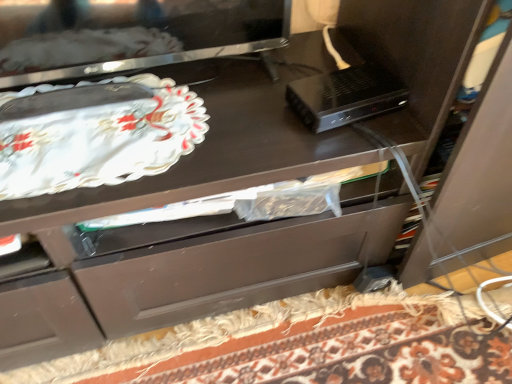
Identify the location of black plastic device at upper right. (345, 96).

What do you see at coordinates (345, 96) in the screenshot? I see `black plastic device at upper right` at bounding box center [345, 96].

You are a GUI agent. You are given a task and a screenshot of the screen. Output one action in this format:
    pyautogui.click(x=<x>, y=<y>)
    Task: Click on the black plastic device at upper right
    
    Given the screenshot: What is the action you would take?
    pyautogui.click(x=345, y=96)